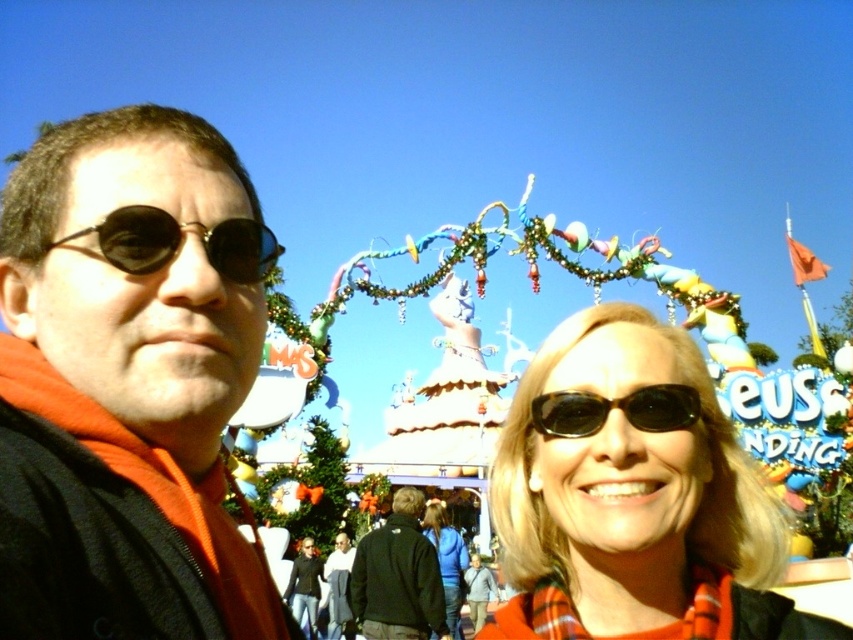
You are planning to hang a large holiday decoration that requires a support structure. Based on the scene, which object would be more suitable to attach it to, the decorative plastic archway at center or the black matte sunglasses at left?

The decorative plastic archway at center is bigger than the black matte sunglasses at left, so it would be more suitable to attach the large holiday decoration to the decorative plastic archway at center.

You are planning to take a photo of the decorative plastic archway at center and the black matte sunglasses at left. Which object should be positioned lower in the frame to ensure both are visible?

The decorative plastic archway at center should be positioned lower in the frame because it is below the black matte sunglasses at left.

You are standing at the center of the festive outdoor setting at the theme park. You see a dark blue jacket at center. Can you confirm if the dark blue jacket at center is located exactly at the coordinate point (399, 577)?

Yes, the dark blue jacket at center is located exactly at the coordinate point (399, 577) as described.